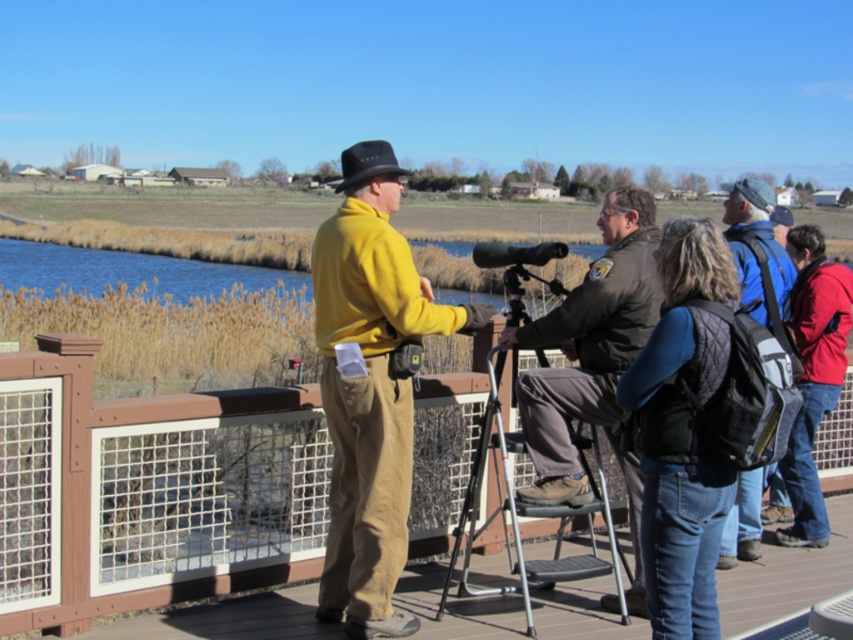
Which is more to the right, wooden fence at lower left or metallic tripod at center?

metallic tripod at center

Describe the element at coordinates (134, 492) in the screenshot. I see `wooden fence at lower left` at that location.

The height and width of the screenshot is (640, 853). I want to click on wooden fence at lower left, so click(134, 492).

Who is taller, wooden fence at lower left or red jacket at right?

Standing taller between the two is red jacket at right.

Describe the element at coordinates (134, 492) in the screenshot. This screenshot has height=640, width=853. I see `wooden fence at lower left` at that location.

Is point (21, 397) positioned before point (798, 454)?

That is True.

Identify the location of wooden fence at lower left. (134, 492).

Who is more forward, [323,227] or [581,515]?

Positioned in front is point [323,227].

Who is higher up, khaki pants at center or metallic tripod at center?

khaki pants at center is higher up.

Does point (338, 563) lie behind point (466, 532)?

No, (338, 563) is in front of (466, 532).

Locate an element on the screen. khaki pants at center is located at coordinates (370, 387).